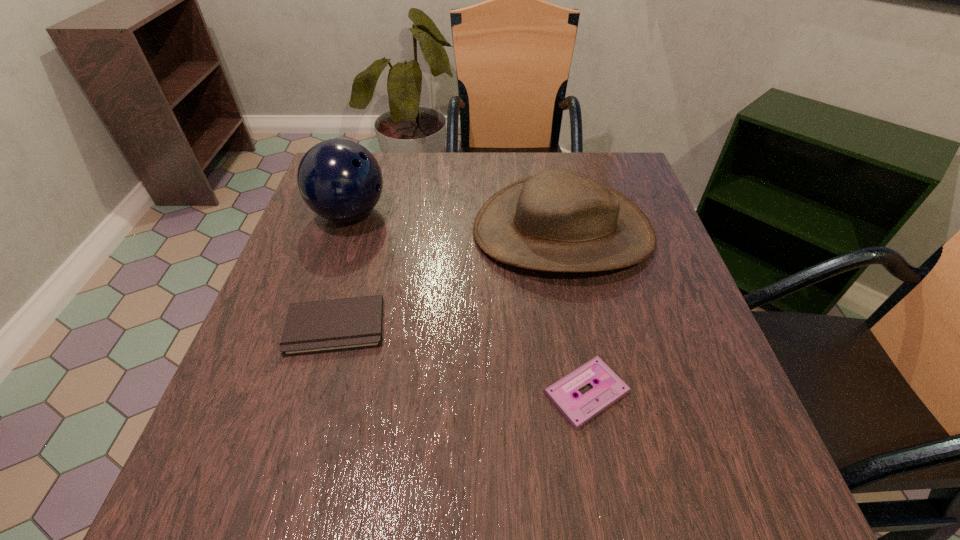
I want to click on vacant space at the right edge of the desktop, so click(x=719, y=444).

Locate an element on the screen. The width and height of the screenshot is (960, 540). vacant space at the near left corner of the desktop is located at coordinates (231, 487).

This screenshot has width=960, height=540. In the image, there is a desktop. In order to click on free region at the far right corner in this screenshot , I will do `click(644, 205)`.

Identify the location of vacant space that is in between the third farthest object and the cowboy hat. The height and width of the screenshot is (540, 960). (449, 279).

Find the location of a particular element. Image resolution: width=960 pixels, height=540 pixels. vacant space that's between the nearest object and the checkbook is located at coordinates (461, 360).

I want to click on unoccupied position between the nearest object and the second tallest object, so tap(575, 312).

Locate an element on the screen. Image resolution: width=960 pixels, height=540 pixels. vacant space in between the nearest object and the second nearest object is located at coordinates (461, 360).

Find the location of `unoccupied position between the checkbook and the tallest object`. unoccupied position between the checkbook and the tallest object is located at coordinates (343, 270).

At what (x,y) coordinates should I click in order to perform the action: click on free space between the cowboy hat and the bowling ball. Please return your answer as a coordinate pair (x, y). Image resolution: width=960 pixels, height=540 pixels. Looking at the image, I should click on (456, 222).

Locate an element on the screen. free space between the tallest object and the nearest object is located at coordinates (468, 303).